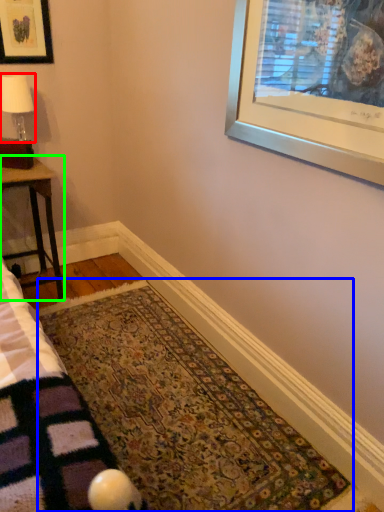
Question: Based on their relative distances, which object is farther from lamp (highlighted by a red box)? Choose from mat (highlighted by a blue box) and table (highlighted by a green box).

Choices:
 (A) mat
 (B) table

Answer: (A)